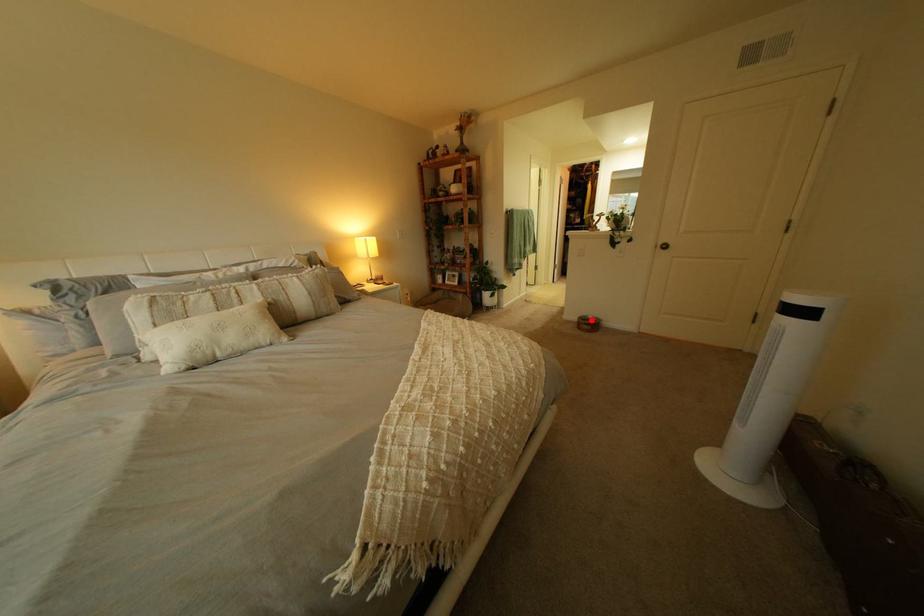
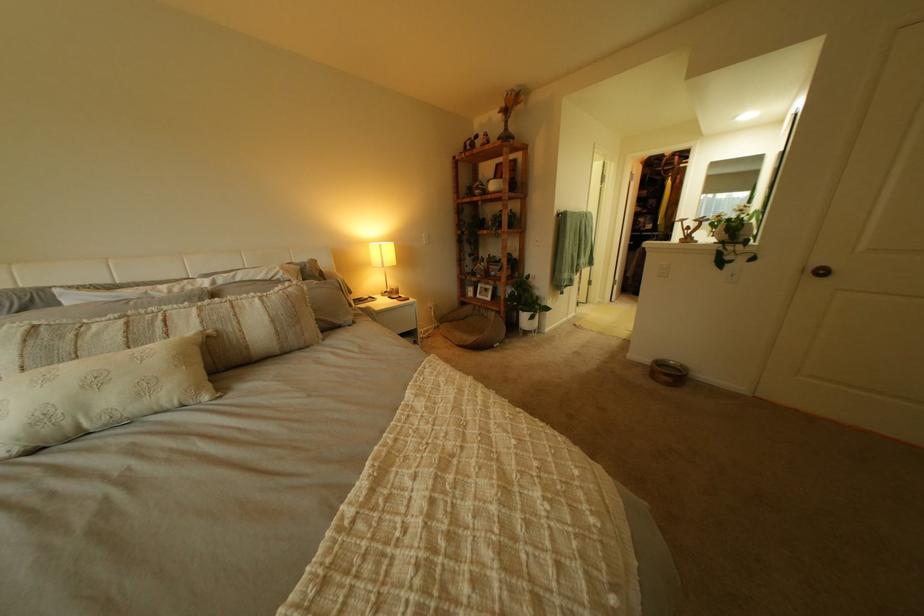
The point at the highlighted location is marked in the first image. Where is the corresponding point in the second image?

(663, 362)